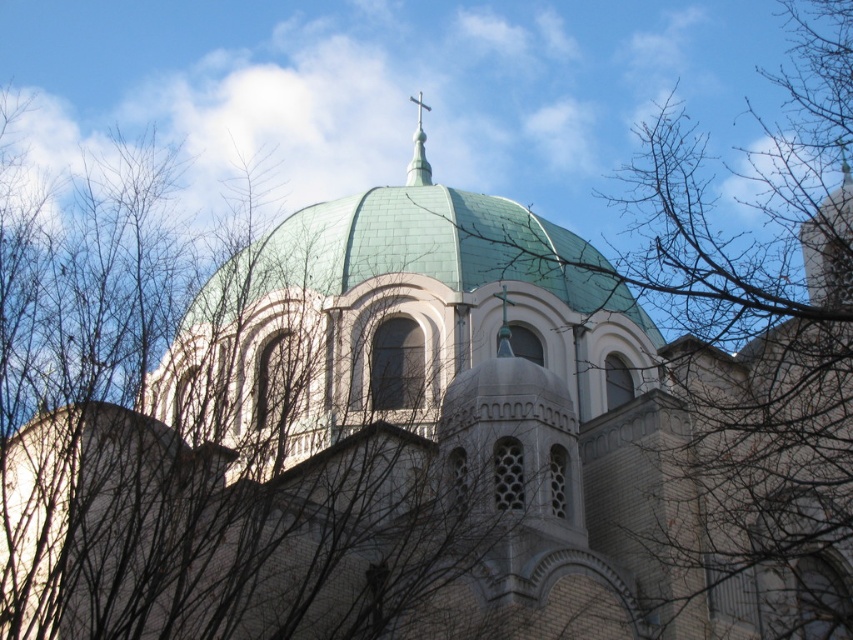
This screenshot has height=640, width=853. Identify the location of bare branches at upper center. (216, 532).

Does point (132, 413) come closer to viewer compared to point (416, 97)?

Yes, point (132, 413) is in front of point (416, 97).

What do you see at coordinates (216, 532) in the screenshot?
I see `bare branches at upper center` at bounding box center [216, 532].

This screenshot has width=853, height=640. In order to click on bare branches at upper center in this screenshot , I will do point(216,532).

What do you see at coordinates (416, 252) in the screenshot? The image size is (853, 640). I see `green tile dome at center` at bounding box center [416, 252].

In the scene shown: Does green tile dome at center appear under green metallic spire at upper center?

Yes, green tile dome at center is below green metallic spire at upper center.

What do you see at coordinates (416, 252) in the screenshot?
I see `green tile dome at center` at bounding box center [416, 252].

Where is `green tile dome at center`? green tile dome at center is located at coordinates (416, 252).